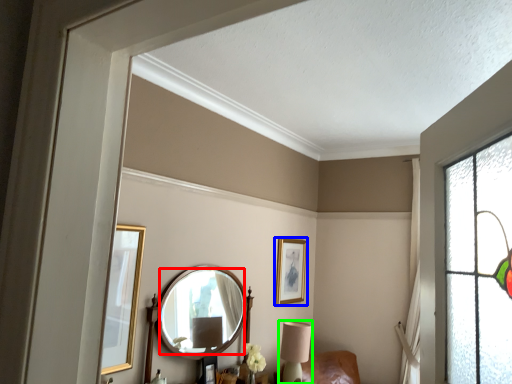
Question: Considering the real-world distances, which object is farthest from mirror (highlighted by a red box)? picture frame (highlighted by a blue box) or table lamp (highlighted by a green box)?

Choices:
 (A) picture frame
 (B) table lamp

Answer: (A)